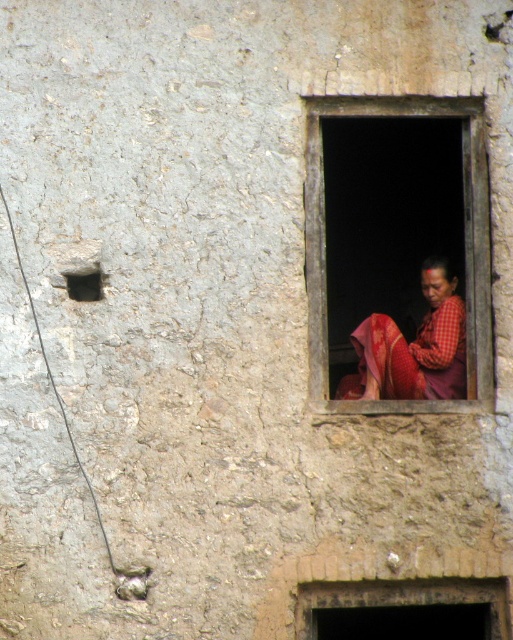
Is point (317, 330) in front of point (455, 374)?

Yes, point (317, 330) is closer to viewer.

Between matte red fabric at center and red plaid fabric at window, which one appears on the left side from the viewer's perspective?

matte red fabric at center is more to the left.

This screenshot has height=640, width=513. Describe the element at coordinates (465, 243) in the screenshot. I see `matte red fabric at center` at that location.

The height and width of the screenshot is (640, 513). I want to click on matte red fabric at center, so click(465, 243).

Who is positioned more to the right, matte red fabric at center or dark gray concrete hole at upper left?

matte red fabric at center is more to the right.

Measure the distance between matte red fabric at center and camera.

matte red fabric at center and camera are 16.14 meters apart.

The width and height of the screenshot is (513, 640). What do you see at coordinates (465, 243) in the screenshot?
I see `matte red fabric at center` at bounding box center [465, 243].

Where is `matte red fabric at center`? matte red fabric at center is located at coordinates (465, 243).

Is red plaid fabric at window to the right of dark gray concrete hole at upper left from the viewer's perspective?

Yes, red plaid fabric at window is to the right of dark gray concrete hole at upper left.

Does red plaid fabric at window have a lesser width compared to dark gray concrete hole at upper left?

No.

This screenshot has height=640, width=513. Identify the location of red plaid fabric at window. (413, 348).